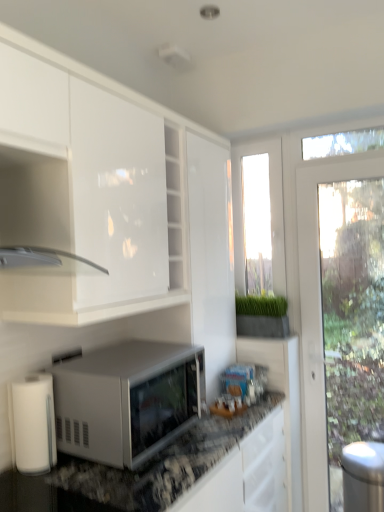
The image size is (384, 512). Describe the element at coordinates (363, 476) in the screenshot. I see `stainless steel trash can at right` at that location.

In order to click on matte white cabinet at upper left in this screenshot , I will do `click(37, 210)`.

Image resolution: width=384 pixels, height=512 pixels. Identify the location of stainless steel trash can at right. (363, 476).

Does white matte microwave at center turn towards matte white cabinet at upper left?

No, white matte microwave at center is not turned towards matte white cabinet at upper left.

From the image's perspective, would you say white matte microwave at center is positioned over matte white cabinet at upper left?

No, from the image's perspective, white matte microwave at center is not over matte white cabinet at upper left.

From a real-world perspective, is white matte microwave at center below matte white cabinet at upper left?

Yes, from a real-world perspective, white matte microwave at center is beneath matte white cabinet at upper left.

Which is more to the left, white matte microwave at center or matte white cabinet at upper left?

Positioned to the left is matte white cabinet at upper left.

Is matte white cabinet at upper left far away from transparent glass window at center, arranged as the first window screen when viewed from the left?

matte white cabinet at upper left is far away from transparent glass window at center, arranged as the first window screen when viewed from the left.

Considering the positions of point (6, 142) and point (245, 251), is point (6, 142) closer or farther from the camera than point (245, 251)?

Clearly, point (6, 142) is closer to the camera than point (245, 251).

Based on their positions, is matte white cabinet at upper left located to the left or right of transparent glass window at center, arranged as the first window screen when viewed from the left?

matte white cabinet at upper left is to the left of transparent glass window at center, arranged as the first window screen when viewed from the left.

Who is bigger, matte white cabinet at upper left or transparent glass window at center, arranged as the first window screen when viewed from the left?

Bigger between the two is matte white cabinet at upper left.

Is transparent glass window at center, arranged as the first window screen when viewed from the left, facing away from white matte paper towel at lower left?

No.

Is transparent glass window at center, arranged as the first window screen when viewed from the left, not within white matte paper towel at lower left?

transparent glass window at center, arranged as the first window screen when viewed from the left, is positioned outside white matte paper towel at lower left.

Is transparent glass window at center, which is counted as the 2th window screen, starting from the right, positioned far away from white matte paper towel at lower left?

Indeed, transparent glass window at center, which is counted as the 2th window screen, starting from the right, is not near white matte paper towel at lower left.

Considering the relative sizes of transparent glass window at center, arranged as the first window screen when viewed from the left, and white matte paper towel at lower left in the image provided, is transparent glass window at center, arranged as the first window screen when viewed from the left, taller than white matte paper towel at lower left?

Yes, transparent glass window at center, arranged as the first window screen when viewed from the left, is taller than white matte paper towel at lower left.

Is transparent glass window at center, which is counted as the 2th window screen, starting from the right, facing towards stainless steel trash can at right?

No.

Which point is more distant from viewer, (x=272, y=217) or (x=349, y=484)?

Positioned behind is point (x=272, y=217).

Can you confirm if transparent glass window at center, arranged as the first window screen when viewed from the left, is shorter than stainless steel trash can at right?

No, transparent glass window at center, arranged as the first window screen when viewed from the left, is not shorter than stainless steel trash can at right.

Looking at this image, which is more to the right, matte white cabinet at upper left or white matte microwave at center?

From the viewer's perspective, white matte microwave at center appears more on the right side.

From the picture: From a real-world perspective, is matte white cabinet at upper left above or below white matte microwave at center?

matte white cabinet at upper left is situated higher than white matte microwave at center in the real world.

Is matte white cabinet at upper left spatially inside white matte microwave at center, or outside of it?

The correct answer is: outside.

Considering the relative sizes of matte white cabinet at upper left and white matte microwave at center in the image provided, is matte white cabinet at upper left wider than white matte microwave at center?

No.

In terms of height, does white matte paper towel at lower left look taller or shorter compared to clear glass window screen at upper right, the 1th window screen in the right-to-left sequence?

In the image, white matte paper towel at lower left appears to be taller than clear glass window screen at upper right, the 1th window screen in the right-to-left sequence.

Does white matte paper towel at lower left touch clear glass window screen at upper right, the 1th window screen in the right-to-left sequence?

There is a gap between white matte paper towel at lower left and clear glass window screen at upper right, the 1th window screen in the right-to-left sequence.

What's the angular difference between white matte paper towel at lower left and clear glass window screen at upper right, which is the second window screen in left-to-right order,'s facing directions?

They differ by 89 degrees in their facing directions.

Based on the photo, who is smaller, white matte paper towel at lower left or clear glass window screen at upper right, which is the second window screen in left-to-right order?

Smaller between the two is clear glass window screen at upper right, which is the second window screen in left-to-right order.

Are clear glass window screen at upper right, the 1th window screen in the right-to-left sequence, and stainless steel trash can at right beside each other?

No, clear glass window screen at upper right, the 1th window screen in the right-to-left sequence, is not making contact with stainless steel trash can at right.

In the scene shown: Is clear glass window screen at upper right, which is the second window screen in left-to-right order, inside the boundaries of stainless steel trash can at right, or outside?

clear glass window screen at upper right, which is the second window screen in left-to-right order, is not enclosed by stainless steel trash can at right.

From the image's perspective, is clear glass window screen at upper right, which is the second window screen in left-to-right order, beneath stainless steel trash can at right?

No, from the image's perspective, clear glass window screen at upper right, which is the second window screen in left-to-right order, is not below stainless steel trash can at right.

Is point (377, 137) farther from viewer compared to point (370, 494)?

Yes, point (377, 137) is farther from viewer.

The height and width of the screenshot is (512, 384). In the image, there is a matte white cabinet at upper left. What are the coordinates of `microwave oven below it (from a real-world perspective)` in the screenshot? It's located at (127, 400).

At what (x,y) coordinates should I click in order to perform the action: click on cabinetry that is in front of the transparent glass window at center, which is counted as the 2th window screen, starting from the right. Please return your answer as a coordinate pair (x, y). The height and width of the screenshot is (512, 384). Looking at the image, I should click on (37, 210).

Considering their positions, is transparent glass window at center, arranged as the first window screen when viewed from the left, positioned closer to white matte microwave at center than white matte paper towel at lower left?

Based on the image, white matte paper towel at lower left appears to be nearer to white matte microwave at center.

When comparing their distances from transparent glass window at center, arranged as the first window screen when viewed from the left, does stainless steel trash can at right or white matte microwave at center seem closer?

white matte microwave at center lies closer to transparent glass window at center, arranged as the first window screen when viewed from the left, than the other object.

From the image, which object appears to be nearer to stainless steel trash can at right, white matte microwave at center or clear glass window screen at upper right, which is the second window screen in left-to-right order?

white matte microwave at center lies closer to stainless steel trash can at right than the other object.

From the image, which object appears to be farther from matte white cabinet at upper left, white matte paper towel at lower left or white matte microwave at center?

Based on the image, white matte paper towel at lower left appears to be further to matte white cabinet at upper left.

Which object lies nearer to the anchor point white matte microwave at center, transparent glass window at center, which is counted as the 2th window screen, starting from the right, or matte white cabinet at upper left?

matte white cabinet at upper left is positioned closer to the anchor white matte microwave at center.

When comparing their distances from matte white cabinet at upper left, does white matte microwave at center or transparent glass window at center, which is counted as the 2th window screen, starting from the right, seem further?

transparent glass window at center, which is counted as the 2th window screen, starting from the right.

Looking at the image, which one is located closer to white matte microwave at center, stainless steel trash can at right or matte white cabinet at upper left?

matte white cabinet at upper left is positioned closer to the anchor white matte microwave at center.

Estimate the real-world distances between objects in this image. Which object is further from white matte microwave at center, white matte paper towel at lower left or stainless steel trash can at right?

stainless steel trash can at right is positioned further to the anchor white matte microwave at center.

Identify the location of paper towel between matte white cabinet at upper left and clear glass window screen at upper right, the 1th window screen in the right-to-left sequence. This screenshot has width=384, height=512. (34, 424).

Where is `microwave oven between white matte paper towel at lower left and stainless steel trash can at right in the horizontal direction`? The width and height of the screenshot is (384, 512). microwave oven between white matte paper towel at lower left and stainless steel trash can at right in the horizontal direction is located at coordinates (127, 400).

The image size is (384, 512). In order to click on window screen located between white matte paper towel at lower left and clear glass window screen at upper right, the 1th window screen in the right-to-left sequence, in the left-right direction in this screenshot , I will do `click(270, 211)`.

Locate an element on the screen. This screenshot has width=384, height=512. microwave oven between transparent glass window at center, arranged as the first window screen when viewed from the left, and stainless steel trash can at right in the up-down direction is located at coordinates (127, 400).